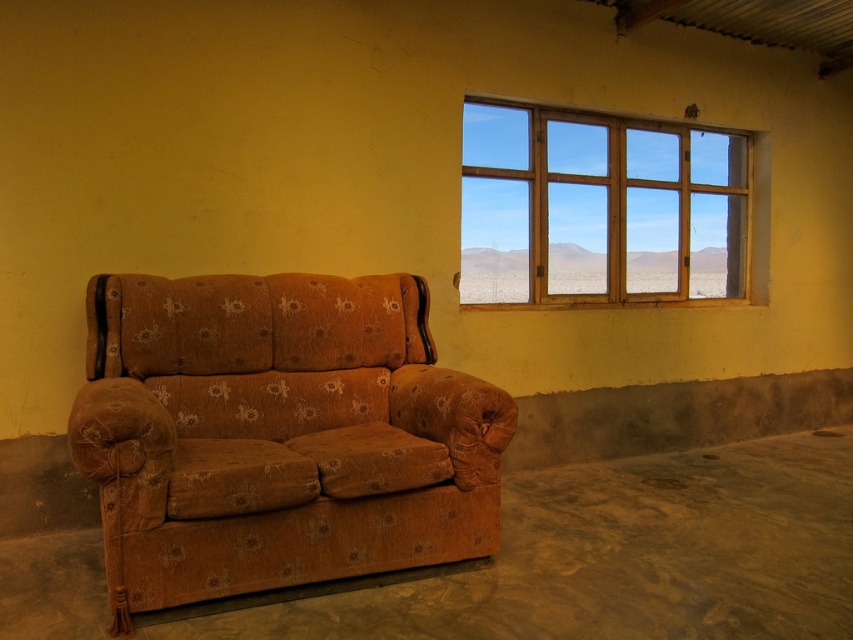
You are a delivery person carrying a package that requires a 6 feet clearance to pass through. You need to move the package from the brown floral fabric couch at lower left to the wooden window at upper right. Can you navigate the space between them without tilting the package?

The distance between the brown floral fabric couch at lower left and the wooden window at upper right is 5.93 feet. Since the required clearance is 6 feet, the package cannot be navigated through the space without tilting it.

You are standing in the room and want to reach the point marked at coordinates (x=265, y=557). Given that your height is 5.5 feet, will you be able to comfortably stand at that point without bumping your head?

The point marked at coordinates (x=265, y=557) is 8.48 feet from the viewer. Since your height is 5.5 feet, you can comfortably stand there without hitting your head as the distance is more than sufficient.

You are standing in the room depicted in the image. Where exactly is the brown floral fabric couch at lower left located in terms of coordinates?

The brown floral fabric couch at lower left is located at point [277,435].